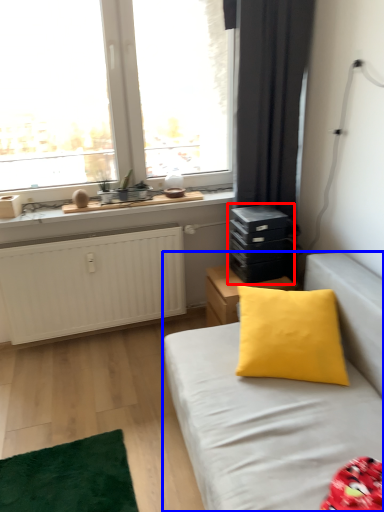
Question: Which point is further to the camera, dresser (highlighted by a red box) or studio couch (highlighted by a blue box)?

Choices:
 (A) dresser
 (B) studio couch

Answer: (A)